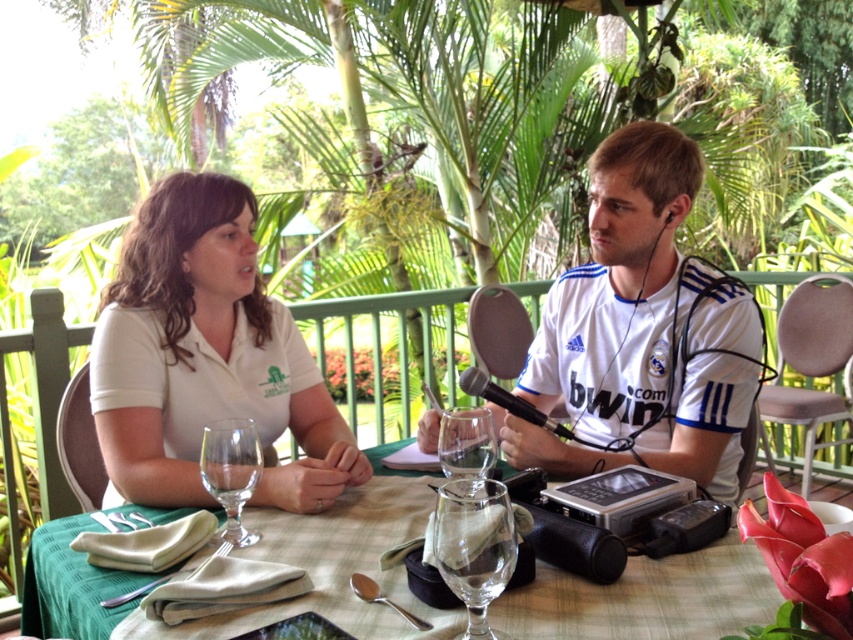
You are a waiter at a cafe and need to place a dessert menu on the table between the transparent glass at center and the silvermetallicspoon at lower center. Where should you place it to ensure it is between them?

The dessert menu should be placed between the transparent glass at center and the silvermetallicspoon at lower center, positioning it behind the transparent glass at center and in front of the silvermetallicspoon at lower center since the glass is in front of the spoon.

You are a photographer trying to capture both the white matte shirt at upper left and the white matte shirt at center in a single frame. Given that the camera can only focus on one shirt at a time, which shirt should you focus on to ensure the larger one is in focus?

The white matte shirt at upper left is larger in size than the white matte shirt at center, so focusing on the white matte shirt at upper left will ensure the larger one is in focus.

In the scene shown: You are a photographer standing at a certain distance from the green fabric table at center. You want to capture a photo where the table fills the frame without being too close to avoid distortion. The ideal distance for this is between 30 to 35 inches. Is your current position suitable?

The distance of green fabric table at center from camera is 32.78 inches, which falls within the ideal range of 30 to 35 inches. Therefore, your current position is suitable for capturing the photo without distortion.